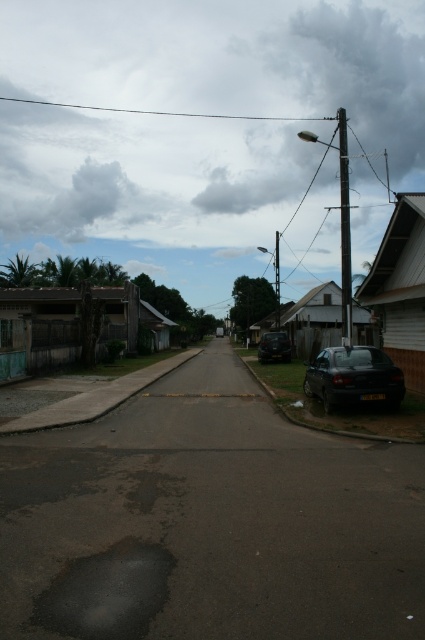
You are a delivery drone that needs to fly over the black wire at upper center and the shiny black car at center. Considering their heights, which one do you need to avoid hitting?

The black wire at upper center is much taller than the shiny black car at center, so you need to avoid hitting the black wire at upper center.

You are standing on the residential street and want to take a photo of both the shiny black car at lower right and the shiny black car at center. Which car should you focus on first to ensure both are in the frame?

You should focus on the shiny black car at lower right first because it is closer to you, so adjusting the camera to include it will also capture the shiny black car at center which is further away.

You are a delivery drone flying over a residential street. You need to navigate between the black wire at upper center and the parked black car on the right side of the street. According to the coordinates provided, which object is closer to the top edge of the image?

The black wire at upper center is closer to the top edge of the image because its y coordinate is 0.376, which is closer to 0 compared to the parked black car on the right side of the street.